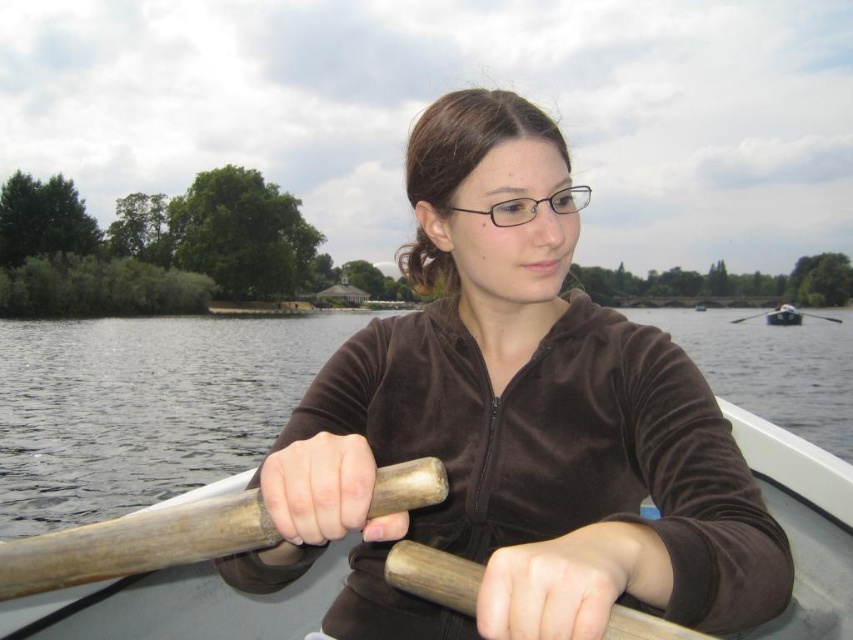
Is brown velvety boat at center closer to camera compared to wooden at right?

Yes, it is.

Identify the location of brown velvety boat at center. The image size is (853, 640). (178, 605).

The image size is (853, 640). What do you see at coordinates (467, 140) in the screenshot? I see `matte brown jacket at center` at bounding box center [467, 140].

Can you confirm if matte brown jacket at center is wider than wooden at center?

Correct, the width of matte brown jacket at center exceeds that of wooden at center.

The image size is (853, 640). I want to click on matte brown jacket at center, so click(467, 140).

Locate an element on the screen. This screenshot has height=640, width=853. matte brown jacket at center is located at coordinates (467, 140).

Does brown wood oar at center appear on the right side of wooden at left?

Indeed, brown wood oar at center is positioned on the right side of wooden at left.

Is point (186, 428) farther from camera compared to point (132, 545)?

Yes, point (186, 428) is behind point (132, 545).

The width and height of the screenshot is (853, 640). What are the coordinates of `brown wood oar at center` in the screenshot? It's located at (142, 406).